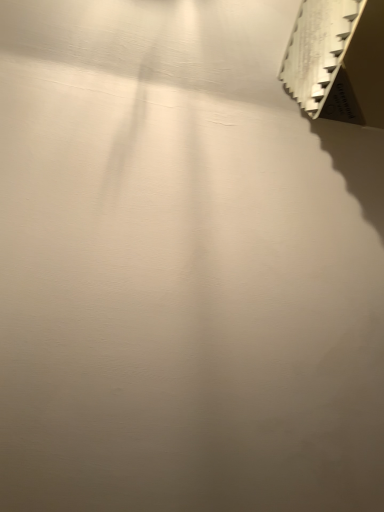
Identify the location of white cardboard box at upper right. This screenshot has height=512, width=384. (338, 61).

In order to face white cardboard box at upper right, should I rotate leftwards or rightwards?

Rotate right and turn 23.935 degrees.

The image size is (384, 512). What do you see at coordinates (338, 61) in the screenshot? I see `white cardboard box at upper right` at bounding box center [338, 61].

Image resolution: width=384 pixels, height=512 pixels. I want to click on white cardboard box at upper right, so click(x=338, y=61).